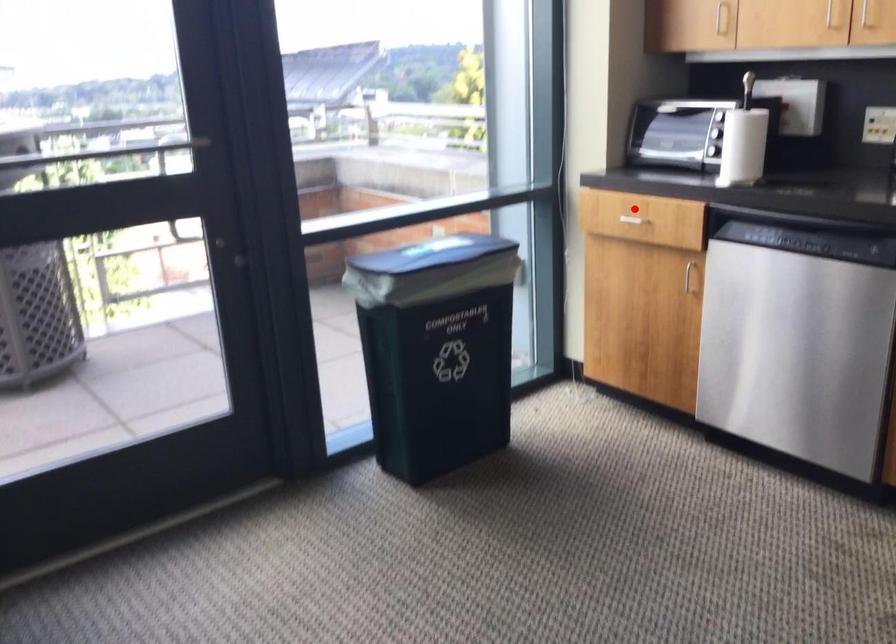
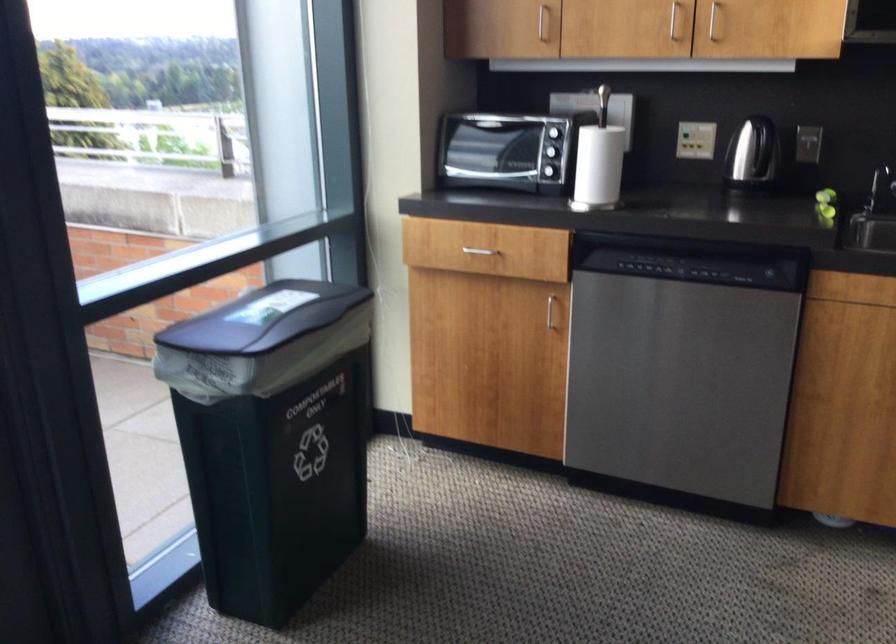
In the second image, find the point that corresponds to the highlighted location in the first image.

(474, 241)